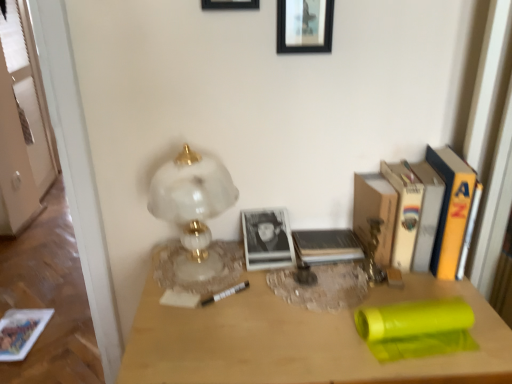
You are a GUI agent. You are given a task and a screenshot of the screen. Output one action in this format:
    pyautogui.click(x=<x>, y=<y>)
    Task: Click on the vacant area that lies in front of yellow paper at right, placed as the 1th paperback book when sorted from right to left
    The width and height of the screenshot is (512, 384).
    Given the screenshot: What is the action you would take?
    pyautogui.click(x=456, y=294)